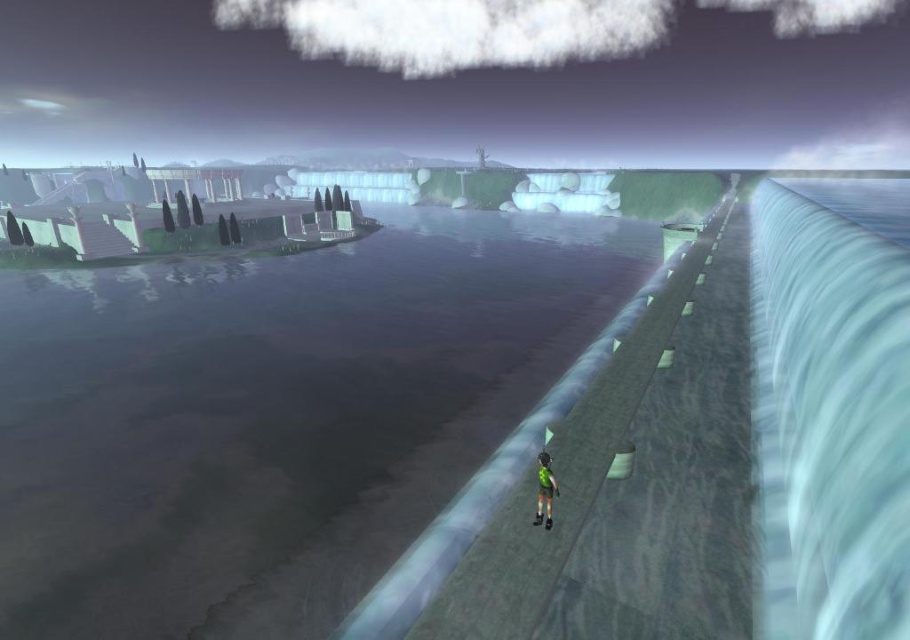
Question: Can you confirm if smooth concrete water at center is positioned to the right of green fabric shorts at center?

Choices:
 (A) no
 (B) yes

Answer: (A)

Question: Is smooth concrete water at center bigger than green fabric shorts at center?

Choices:
 (A) no
 (B) yes

Answer: (B)

Question: Which of the following is the closest to the observer?

Choices:
 (A) smooth concrete water at center
 (B) green fabric shorts at center

Answer: (B)

Question: From the image, what is the correct spatial relationship of smooth concrete water at center in relation to green fabric shorts at center?

Choices:
 (A) right
 (B) left

Answer: (B)